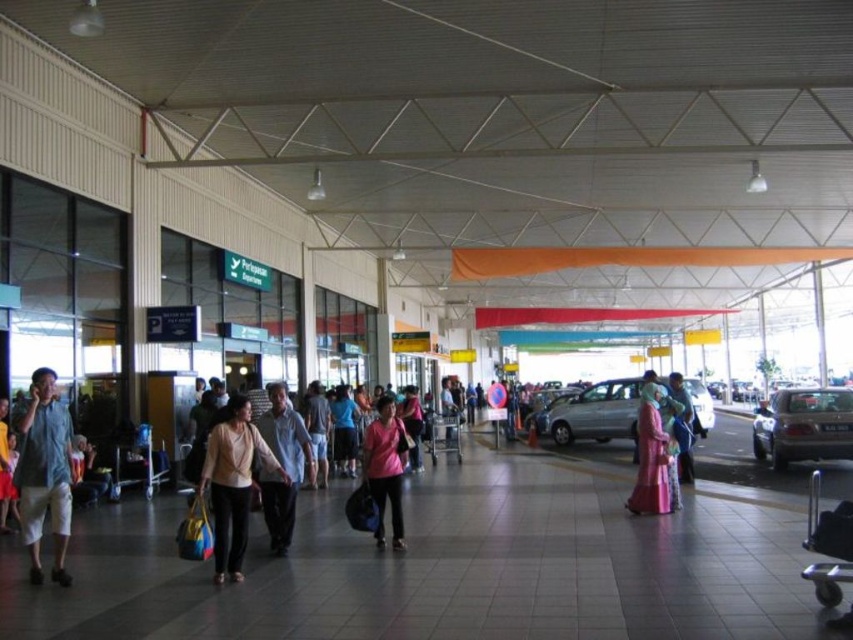
Where is the denim shorts at left located in the image?

The denim shorts at left is located at point (44, 474).

You are a photographer standing in the airport terminal and want to take a photo of both the pink satin dress at center and the light blue denim shorts at center. Which one should you focus on first to ensure both are in the frame?

You should focus on the pink satin dress at center first because it is closer to the viewer than the light blue denim shorts at center, ensuring both will be in the frame when adjusting the camera.